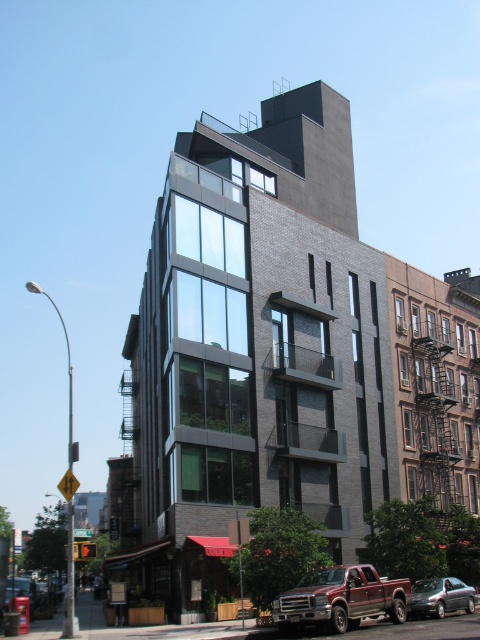
Which is above, matte red truck at lower right or metallic silver sedan at center?

Positioned higher is matte red truck at lower right.

From the picture: Does matte red truck at lower right appear under metallic silver sedan at center?

Actually, matte red truck at lower right is above metallic silver sedan at center.

Is point (334, 582) closer to camera compared to point (437, 611)?

Yes, point (334, 582) is in front of point (437, 611).

Locate an element on the screen. The width and height of the screenshot is (480, 640). matte red truck at lower right is located at coordinates (342, 598).